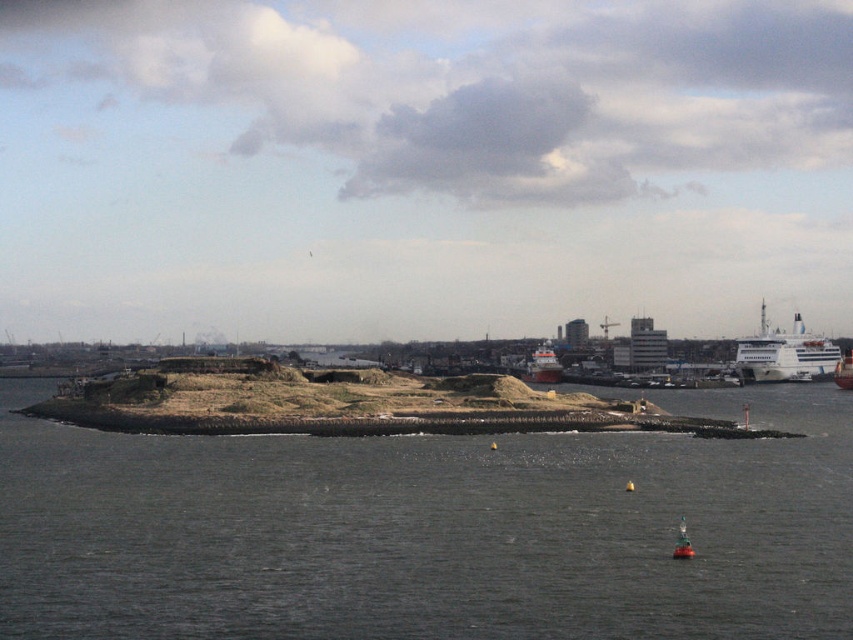
Who is positioned more to the left, white glossy cruise ship at right or white matte ship at center-right?

From the viewer's perspective, white matte ship at center-right appears more on the left side.

Measure the distance between white glossy cruise ship at right and camera.

The distance of white glossy cruise ship at right from camera is 254.03 meters.

Between point (814, 352) and point (550, 353), which one is positioned behind?

Point (550, 353)

This screenshot has height=640, width=853. I want to click on white glossy cruise ship at right, so click(x=784, y=353).

Consider the image. Between dark gray water at center and metallic red buoy at lower right, which one appears on the right side from the viewer's perspective?

metallic red buoy at lower right

Which is above, dark gray water at center or metallic red buoy at lower right?

metallic red buoy at lower right is above.

Identify the location of dark gray water at center. (431, 529).

Can you confirm if dark gray water at center is positioned to the left of white glossy ship at right?

Indeed, dark gray water at center is positioned on the left side of white glossy ship at right.

Does point (491, 515) come behind point (849, 365)?

No, it is not.

You are a GUI agent. You are given a task and a screenshot of the screen. Output one action in this format:
    pyautogui.click(x=<x>, y=<y>)
    Task: Click on the dark gray water at center
    
    Given the screenshot: What is the action you would take?
    pyautogui.click(x=431, y=529)